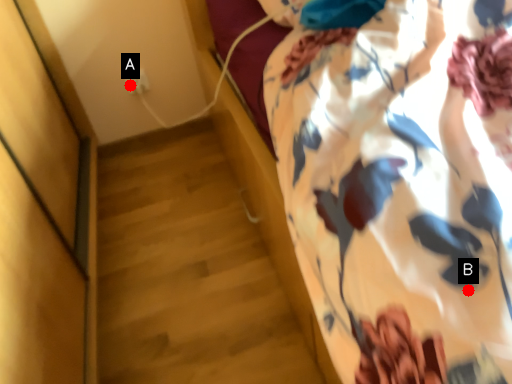
Question: Two points are circled on the image, labeled by A and B beside each circle. Among these points, which one is nearest to the camera?

Choices:
 (A) A is closer
 (B) B is closer

Answer: (B)